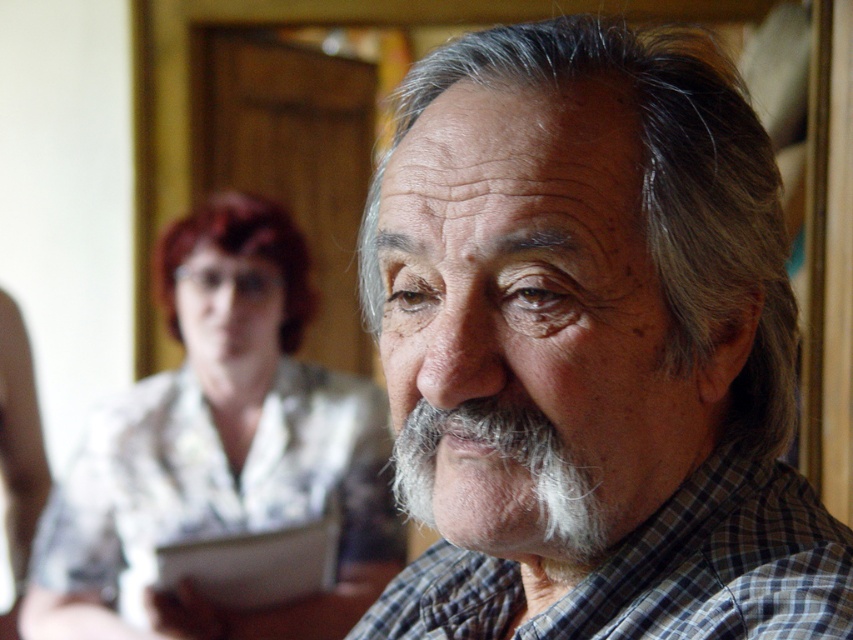
Can you confirm if gray/soft hair at center is shorter than dark red hair at upper left?

Yes, gray/soft hair at center is shorter than dark red hair at upper left.

Looking at this image, who is positioned more to the right, gray/soft hair at center or dark red hair at upper left?

Positioned to the right is gray/soft hair at center.

Is point (561, 548) less distant than point (291, 221)?

Yes, point (561, 548) is in front of point (291, 221).

Identify the location of gray/soft hair at center. (503, 465).

How far apart are gray matte hair at center and dark red hair at upper left?

A distance of 4.26 feet exists between gray matte hair at center and dark red hair at upper left.

Is gray matte hair at center shorter than dark red hair at upper left?

Incorrect, gray matte hair at center's height does not fall short of dark red hair at upper left's.

Who is more distant from viewer, (544, 84) or (300, 262)?

The point (300, 262) is behind.

At what (x,y) coordinates should I click in order to perform the action: click on gray matte hair at center. Please return your answer as a coordinate pair (x, y). The width and height of the screenshot is (853, 640). Looking at the image, I should click on (656, 192).

Which of these two, gray matte hair at center or gray/soft hair at center, stands taller?

With more height is gray matte hair at center.

Which is more to the right, gray matte hair at center or gray/soft hair at center?

gray matte hair at center

The image size is (853, 640). Find the location of `gray matte hair at center`. gray matte hair at center is located at coordinates (656, 192).